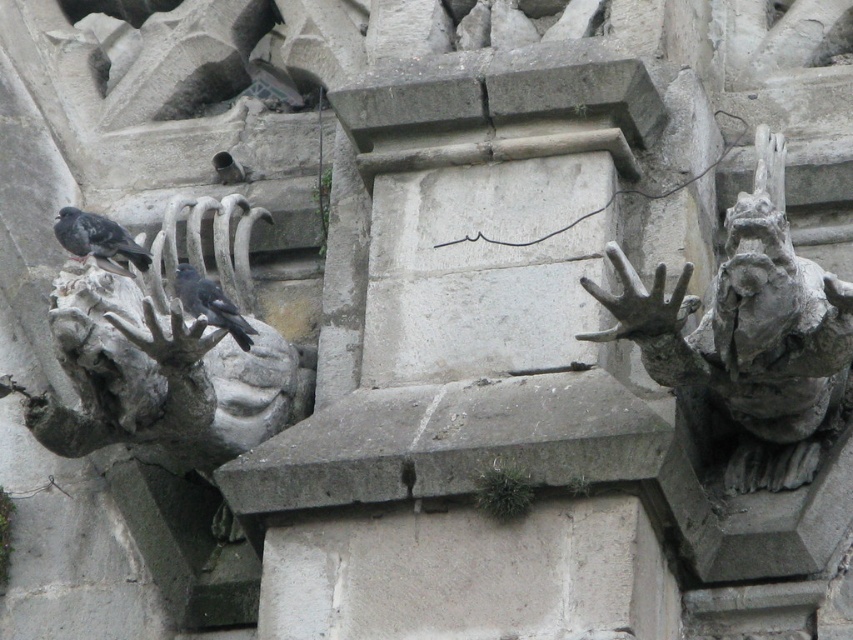
You are standing in front of the stone structure and see two points marked on the image. If you were to walk towards the structure, which point would you encounter first, point (822,401) or point (115,230)?

Point (822,401) is in front of point (115,230), so you would encounter point (822,401) first when approaching the structure.

You are an architect planning to install a new decorative element between the gray stone gargoyle at right and another gargoyle not shown in the image. If the distance between them is 56.53 meters, what is the minimum length of the walkway needed to connect both gargoyles?

The minimum length of the walkway needed to connect both gargoyles is 56.53 meters, as that is the distance between the gray stone gargoyle at right and the other gargoyle.